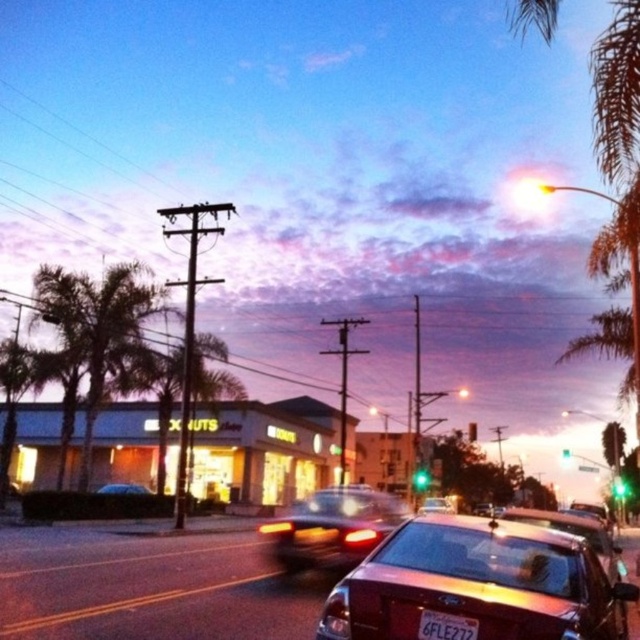
You are a delivery person trying to decide which car to park behind for shade. The shiny red sedan at center and the shiny metallic car at center are both in your path. Which car should you choose to park behind if you want more shade coverage?

The shiny metallic car at center is taller than the shiny red sedan at center, so parking behind the shiny metallic car at center would provide more shade coverage.

You are a pedestrian standing on the sidewalk and see the shiny red sedan at center and the shiny metallic car at center. Which one is closer to the left side of the road?

The shiny red sedan at center is positioned on the left side of the shiny metallic car at center, so it is closer to the left side of the road.

You are a delivery driver who needs to park your car in a spot that can only accommodate vehicles smaller than the metallic silver car at center. You have a white plastic license plate at center on your car. Can you safely park there?

The metallic silver car at center is bigger than the white plastic license plate at center. Since the parking spot can only accommodate vehicles smaller than the metallic silver car at center, and your car has a white plastic license plate at center, it is unclear if your vehicle meets the size requirement based solely on the license plate information provided.